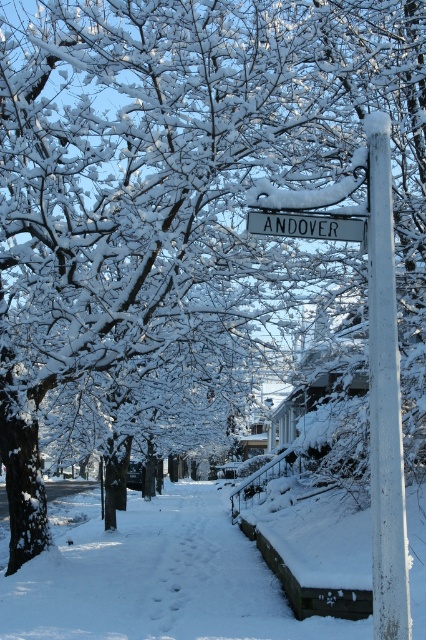
You are a delivery person trying to deliver a package to the house at the end of the sidewalk. The sidewalk is 30 feet long. You are standing at the starting point of the sidewalk. Can you reach the house without stepping off the sidewalk, considering the distance between the white powdery snow at center and the white painted wood post at center right?

The distance between the white powdery snow at center and the white painted wood post at center right is 28.87 feet. Since the sidewalk is 30 feet long, you can reach the house without stepping off the sidewalk as the distance between them is less than the total length of the sidewalk.